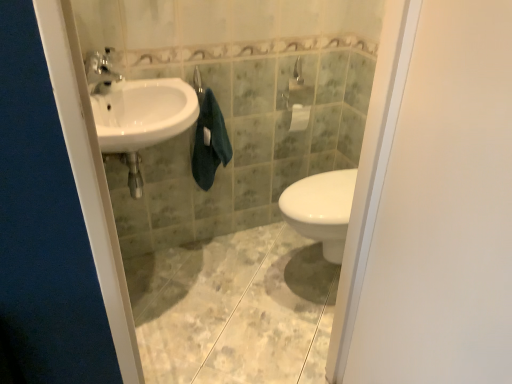
Question: Does white glossy sink at left appear on the left side of white matte screen door at right?

Choices:
 (A) yes
 (B) no

Answer: (A)

Question: Considering the relative sizes of white glossy sink at left and white matte screen door at right in the image provided, is white glossy sink at left taller than white matte screen door at right?

Choices:
 (A) yes
 (B) no

Answer: (B)

Question: Is white glossy sink at left positioned in front of white matte screen door at right?

Choices:
 (A) no
 (B) yes

Answer: (A)

Question: Considering the relative positions of white glossy sink at left and white matte screen door at right in the image provided, is white glossy sink at left behind white matte screen door at right?

Choices:
 (A) no
 (B) yes

Answer: (B)

Question: Does white glossy sink at left turn towards white matte screen door at right?

Choices:
 (A) yes
 (B) no

Answer: (A)

Question: Is white glossy sink at left turned away from white matte screen door at right?

Choices:
 (A) yes
 (B) no

Answer: (B)

Question: Can you confirm if dark green towel at center is taller than white glossy sink at left?

Choices:
 (A) yes
 (B) no

Answer: (A)

Question: From a real-world perspective, is dark green towel at center physically above white glossy sink at left?

Choices:
 (A) yes
 (B) no

Answer: (B)

Question: Considering the relative sizes of dark green towel at center and white glossy sink at left in the image provided, is dark green towel at center thinner than white glossy sink at left?

Choices:
 (A) no
 (B) yes

Answer: (B)

Question: Is dark green towel at center positioned beyond the bounds of white glossy sink at left?

Choices:
 (A) yes
 (B) no

Answer: (A)

Question: Is white glossy sink at left completely or partially inside dark green towel at center?

Choices:
 (A) yes
 (B) no

Answer: (B)

Question: Is dark green towel at center facing away from white glossy sink at left?

Choices:
 (A) no
 (B) yes

Answer: (A)

Question: Can you confirm if white glossy sink at left is thinner than dark green towel at center?

Choices:
 (A) no
 (B) yes

Answer: (A)